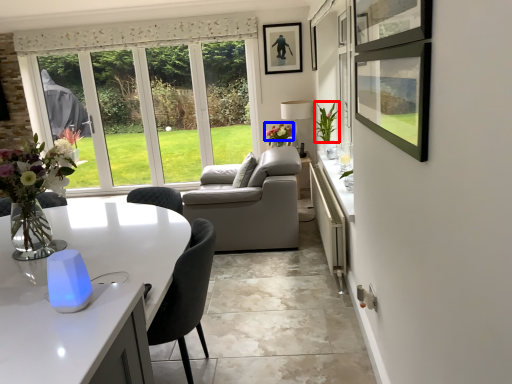
Question: Which object is further to the camera taking this photo, flower (highlighted by a red box) or flower (highlighted by a blue box)?

Choices:
 (A) flower
 (B) flower

Answer: (B)